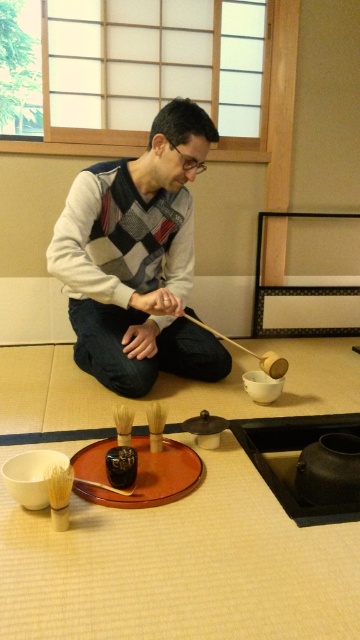
Looking at this image, is knit sweater at center bigger than wooden mallet at center?

Yes, knit sweater at center is bigger than wooden mallet at center.

From the picture: Which is more to the right, knit sweater at center or wooden mallet at center?

wooden mallet at center

What are the coordinates of `knit sweater at center` in the screenshot? It's located at (137, 259).

Does knit sweater at center have a smaller size compared to brown wooden brush at center?

Incorrect, knit sweater at center is not smaller in size than brown wooden brush at center.

Which is below, knit sweater at center or brown wooden brush at center?

Positioned lower is brown wooden brush at center.

Is point (82, 250) positioned behind point (159, 433)?

Yes, point (82, 250) is farther from viewer.

The image size is (360, 640). I want to click on knit sweater at center, so click(x=137, y=259).

Which of these two, brown wooden tray at center or brown wooden brush at center, stands shorter?

Standing shorter between the two is brown wooden tray at center.

Who is lower down, brown wooden tray at center or brown wooden brush at center?

brown wooden tray at center

Is point (105, 449) less distant than point (155, 444)?

No, it is not.

Locate an element on the screen. The height and width of the screenshot is (640, 360). brown wooden tray at center is located at coordinates (151, 476).